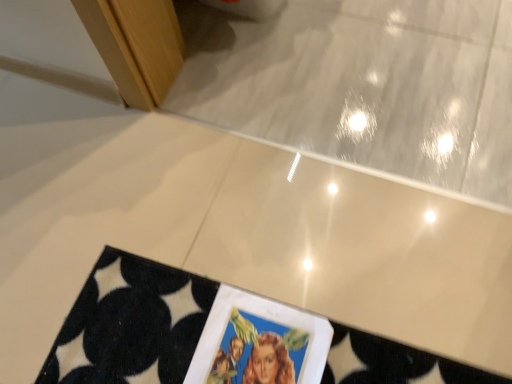
At what (x,y) coordinates should I click in order to perform the action: click on free location to the right of white glossy tablet at center. Please return your answer as a coordinate pair (x, y). This screenshot has width=512, height=384. Looking at the image, I should click on (381, 316).